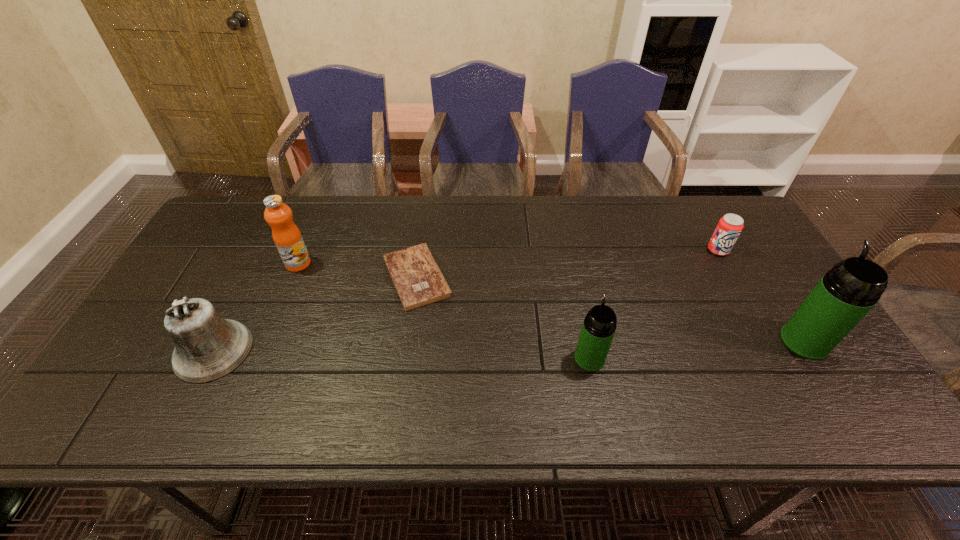
This screenshot has height=540, width=960. I want to click on the left thermos bottle, so click(x=599, y=326).

The image size is (960, 540). What are the coordinates of `the third object from right to left` in the screenshot? It's located at tap(599, 326).

Identify the location of the rightmost object. The image size is (960, 540). (846, 293).

Image resolution: width=960 pixels, height=540 pixels. I want to click on the taller thermos bottle, so click(x=846, y=293).

I want to click on fruit juice, so click(x=287, y=237).

Find the location of a particular element. The image size is (960, 540). the fifth tallest object is located at coordinates (730, 226).

The height and width of the screenshot is (540, 960). I want to click on the second object from right to left, so click(730, 226).

Locate an element on the screen. The height and width of the screenshot is (540, 960). Bible is located at coordinates (418, 280).

In order to click on the fourth object from right to left in this screenshot , I will do `click(418, 280)`.

Find the location of `bell`. bell is located at coordinates (207, 347).